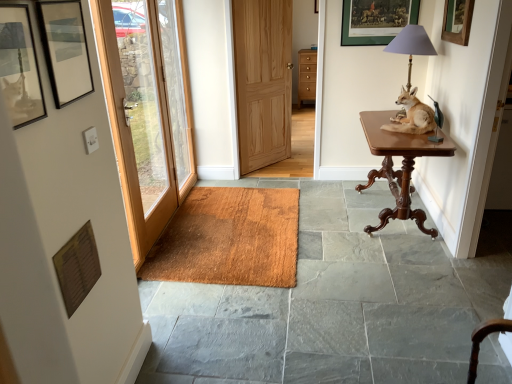
You are a GUI agent. You are given a task and a screenshot of the screen. Output one action in this format:
    pyautogui.click(x=<x>, y=<y>)
    Task: Click on the vacant space underneath brown fur dog at right (from a real-world perspective)
    The height and width of the screenshot is (384, 512).
    Given the screenshot: What is the action you would take?
    pyautogui.click(x=393, y=124)